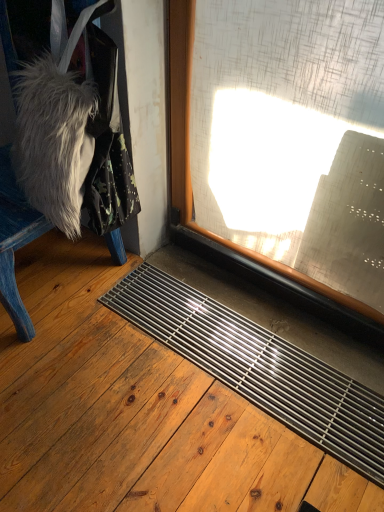
Question: From a real-world perspective, is blue painted wood chair at left positioned over metallic grid at lower center based on gravity?

Choices:
 (A) yes
 (B) no

Answer: (A)

Question: Is blue painted wood chair at left taller than metallic grid at lower center?

Choices:
 (A) yes
 (B) no

Answer: (A)

Question: Is blue painted wood chair at left far away from metallic grid at lower center?

Choices:
 (A) no
 (B) yes

Answer: (A)

Question: Is blue painted wood chair at left at the left side of metallic grid at lower center?

Choices:
 (A) no
 (B) yes

Answer: (B)

Question: Is blue painted wood chair at left wider than metallic grid at lower center?

Choices:
 (A) no
 (B) yes

Answer: (A)

Question: Is the position of blue painted wood chair at left less distant than that of metallic grid at lower center?

Choices:
 (A) no
 (B) yes

Answer: (A)

Question: From a real-world perspective, is metallic grid at lower center over blue painted wood chair at left?

Choices:
 (A) yes
 (B) no

Answer: (B)

Question: Is metallic grid at lower center smaller than blue painted wood chair at left?

Choices:
 (A) yes
 (B) no

Answer: (A)

Question: Does metallic grid at lower center turn towards blue painted wood chair at left?

Choices:
 (A) yes
 (B) no

Answer: (A)

Question: Is metallic grid at lower center to the left of blue painted wood chair at left from the viewer's perspective?

Choices:
 (A) no
 (B) yes

Answer: (A)

Question: From the image's perspective, is metallic grid at lower center over blue painted wood chair at left?

Choices:
 (A) no
 (B) yes

Answer: (A)

Question: Can you confirm if metallic grid at lower center is taller than blue painted wood chair at left?

Choices:
 (A) yes
 (B) no

Answer: (B)

Question: Would you say transparent glass window at center is outside metallic grid at lower center?

Choices:
 (A) yes
 (B) no

Answer: (A)